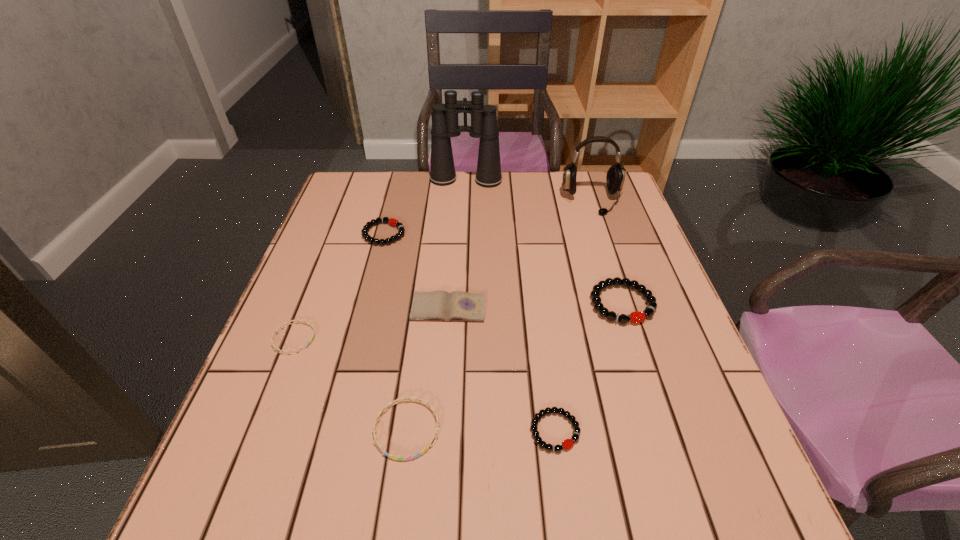
Locate which object ranks seventh in proximity to the second tallest object. Please provide its 2D coordinates. Your answer should be formatted as a tuple, i.e. [(x, y)], where the tuple contains the x and y coordinates of a point satisfying the conditions above.

[(296, 321)]

This screenshot has width=960, height=540. In order to click on object that is the third closest one to the farthest bracelet in this screenshot , I will do `click(296, 321)`.

Locate which bracelet ranks in proximity to the biggest black bracelet. Please provide its 2D coordinates. Your answer should be formatted as a tuple, i.e. [(x, y)], where the tuple contains the x and y coordinates of a point satisfying the conditions above.

[(568, 443)]

This screenshot has height=540, width=960. Identify the location of the fourth closest bracelet to the diary. (568, 443).

Identify which black bracelet is the nearest to the diary. Please provide its 2D coordinates. Your answer should be formatted as a tuple, i.e. [(x, y)], where the tuple contains the x and y coordinates of a point satisfying the conditions above.

[(393, 222)]

Where is `the third closest black bracelet to the shortest bracelet`? This screenshot has width=960, height=540. the third closest black bracelet to the shortest bracelet is located at coordinates (636, 317).

The image size is (960, 540). Find the location of `blank area in the image that satisfies the following two spatial constraints: 1. on the surface of the sixth object from left to right showing star-shaped elements; 2. on the left side of the leftmost bracelet`. blank area in the image that satisfies the following two spatial constraints: 1. on the surface of the sixth object from left to right showing star-shaped elements; 2. on the left side of the leftmost bracelet is located at coordinates (257, 431).